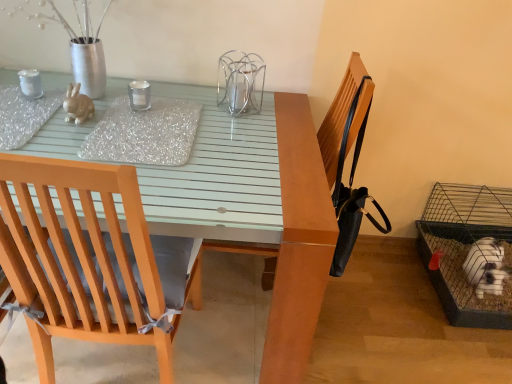
This screenshot has height=384, width=512. I want to click on empty space that is ontop of matte glass table at center (from a real-world perspective), so click(90, 118).